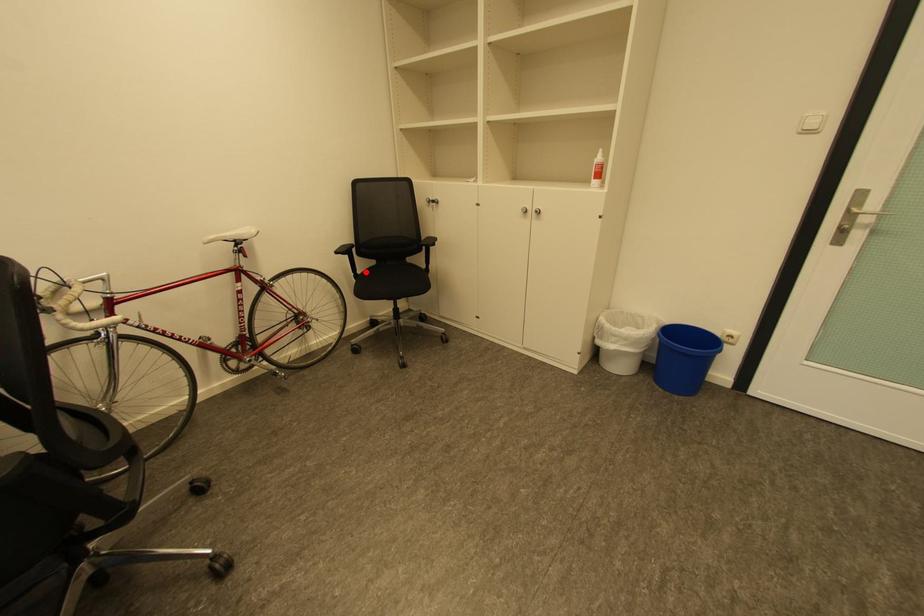
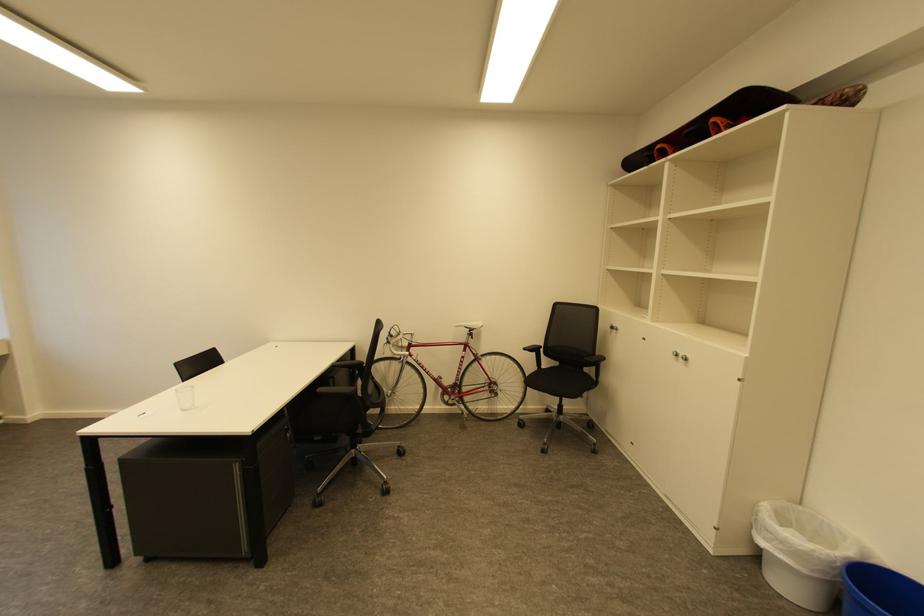
The point at the highlighted location is marked in the first image. Where is the corresponding point in the second image?

(551, 368)